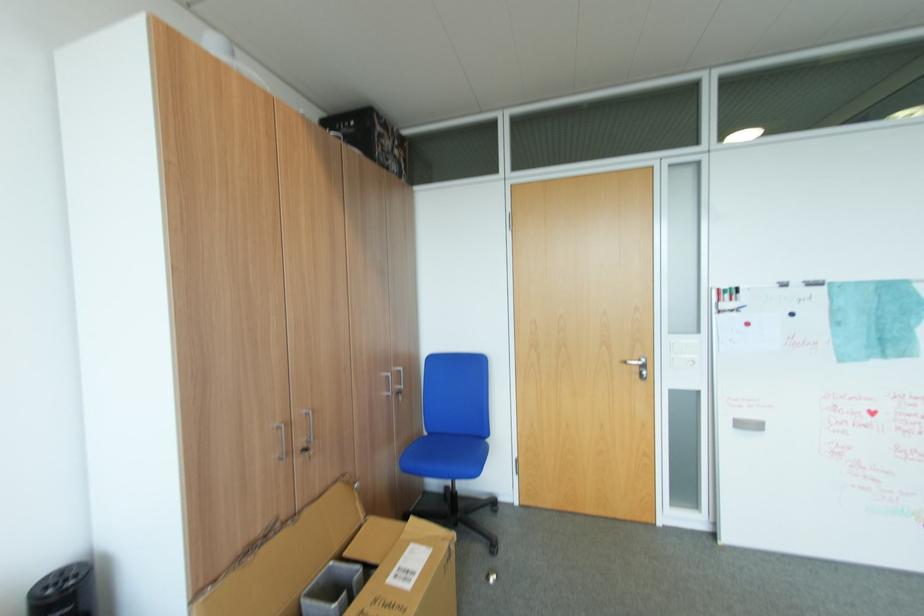
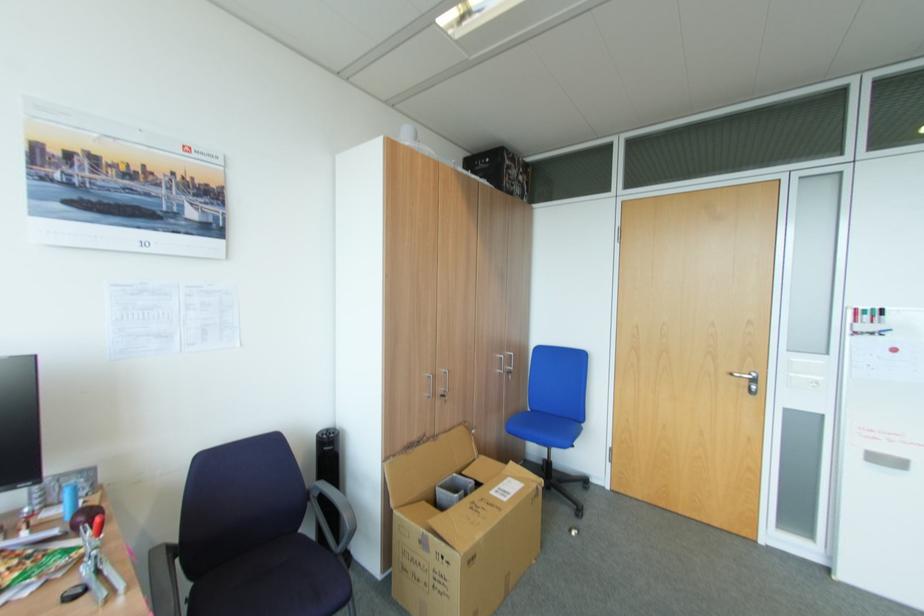
Locate, in the second image, the point that corresponds to point 724,301 in the first image.

(861, 322)